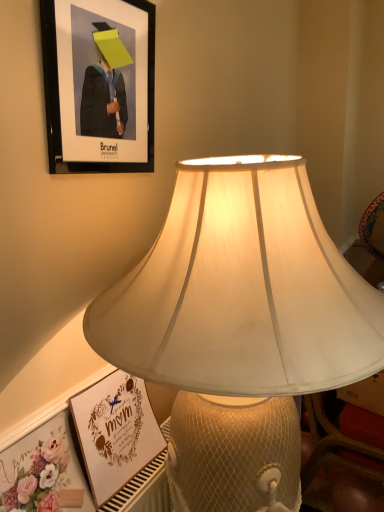
Question: Is matte white lampshade at center in contact with matte white frame at lower left, marked as the 2th picture frame in a top-to-bottom arrangement?

Choices:
 (A) yes
 (B) no

Answer: (B)

Question: Considering the relative sizes of matte white lampshade at center and matte white frame at lower left, the 1th picture frame when ordered from bottom to top, in the image provided, is matte white lampshade at center taller than matte white frame at lower left, the 1th picture frame when ordered from bottom to top,?

Choices:
 (A) yes
 (B) no

Answer: (A)

Question: Would you say matte white lampshade at center contains matte white frame at lower left, marked as the 2th picture frame in a top-to-bottom arrangement?

Choices:
 (A) no
 (B) yes

Answer: (B)

Question: From the image's perspective, is matte white lampshade at center under matte white frame at lower left, the 1th picture frame when ordered from bottom to top?

Choices:
 (A) yes
 (B) no

Answer: (B)

Question: Is matte white lampshade at center at the left side of matte white frame at lower left, marked as the 2th picture frame in a top-to-bottom arrangement?

Choices:
 (A) yes
 (B) no

Answer: (B)

Question: Based on their sizes in the image, would you say black matte picture frame at upper left, marked as the 2th picture frame in a bottom-to-top arrangement, is bigger or smaller than matte white frame at lower left, the 1th picture frame when ordered from bottom to top?

Choices:
 (A) big
 (B) small

Answer: (B)

Question: From their relative heights in the image, would you say black matte picture frame at upper left, marked as the 1th picture frame in a top-to-bottom arrangement, is taller or shorter than matte white frame at lower left, the 1th picture frame when ordered from bottom to top?

Choices:
 (A) short
 (B) tall

Answer: (B)

Question: In terms of width, does black matte picture frame at upper left, marked as the 2th picture frame in a bottom-to-top arrangement, look wider or thinner when compared to matte white frame at lower left, marked as the 2th picture frame in a top-to-bottom arrangement?

Choices:
 (A) wide
 (B) thin

Answer: (B)

Question: In the image, is black matte picture frame at upper left, marked as the 1th picture frame in a top-to-bottom arrangement, on the left side or the right side of matte white frame at lower left, marked as the 2th picture frame in a top-to-bottom arrangement?

Choices:
 (A) right
 (B) left

Answer: (B)

Question: Is floral paper at lower left bigger or smaller than black matte picture frame at upper left, marked as the 2th picture frame in a bottom-to-top arrangement?

Choices:
 (A) small
 (B) big

Answer: (A)

Question: Is point (44, 503) positioned closer to the camera than point (94, 2)?

Choices:
 (A) farther
 (B) closer

Answer: (B)

Question: From the image's perspective, is floral paper at lower left located above or below black matte picture frame at upper left, marked as the 2th picture frame in a bottom-to-top arrangement?

Choices:
 (A) below
 (B) above

Answer: (A)

Question: From a real-world perspective, is floral paper at lower left positioned above or below black matte picture frame at upper left, marked as the 1th picture frame in a top-to-bottom arrangement?

Choices:
 (A) above
 (B) below

Answer: (B)

Question: Is matte white lampshade at center wider or thinner than black matte picture frame at upper left, marked as the 1th picture frame in a top-to-bottom arrangement?

Choices:
 (A) thin
 (B) wide

Answer: (B)

Question: Based on their sizes in the image, would you say matte white lampshade at center is bigger or smaller than black matte picture frame at upper left, marked as the 2th picture frame in a bottom-to-top arrangement?

Choices:
 (A) big
 (B) small

Answer: (A)